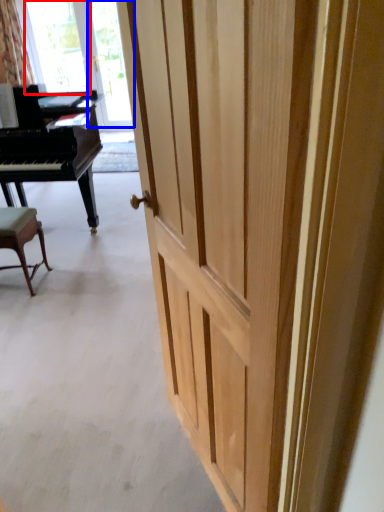
Question: Among these objects, which one is farthest to the camera, window screen (highlighted by a red box) or glass door (highlighted by a blue box)?

Choices:
 (A) window screen
 (B) glass door

Answer: (A)